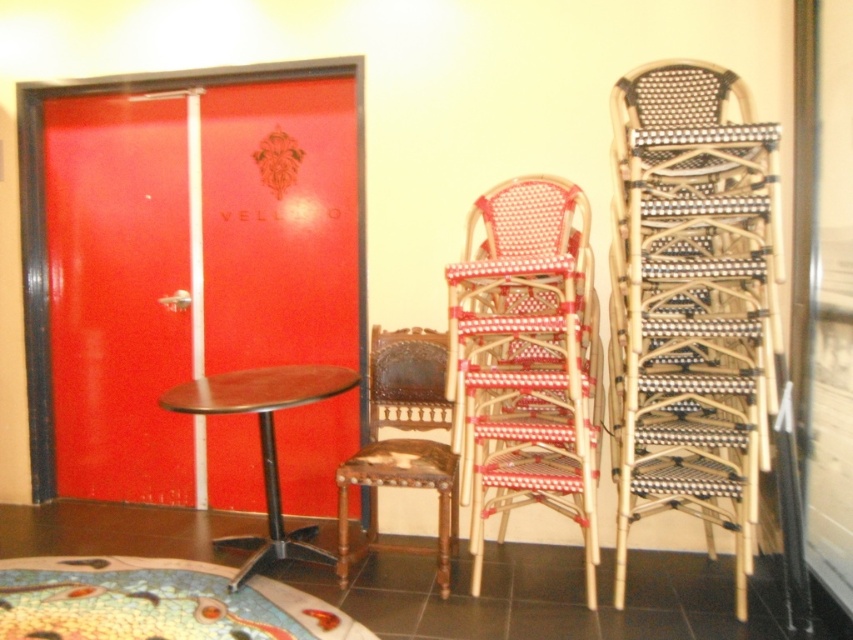
Question: Does woven rattan chairs at right have a larger size compared to dark brown wood table at center?

Choices:
 (A) yes
 (B) no

Answer: (B)

Question: Considering the real-world distances, which object is farthest from the woven rattan chair at center?

Choices:
 (A) woven rattan chairs at right
 (B) dark brown wood table at center
 (C) shiny red door at left

Answer: (C)

Question: Can you confirm if woven rattan chairs at right is positioned above woven rattan chair at center?

Choices:
 (A) yes
 (B) no

Answer: (A)

Question: Can you confirm if woven rattan chairs at right is bigger than woven rattan chair at center?

Choices:
 (A) yes
 (B) no

Answer: (A)

Question: Based on their relative distances, which object is farther from the dark brown wood table at center?

Choices:
 (A) woven rattan chair at center
 (B) shiny red door at left

Answer: (A)

Question: Among these objects, which one is farthest from the camera?

Choices:
 (A) shiny red door at left
 (B) dark brown wood table at center
 (C) brown wood chair at center
 (D) woven rattan chairs at right

Answer: (A)